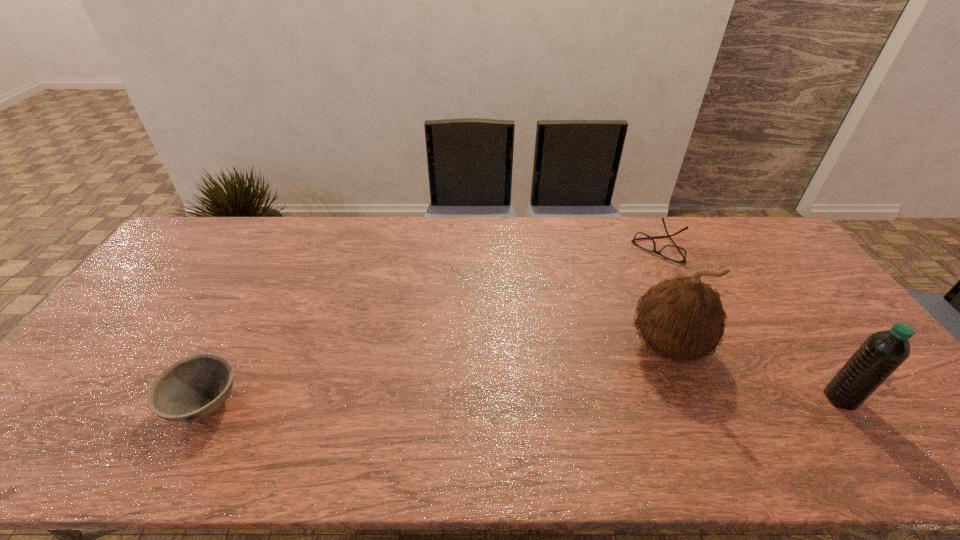
The height and width of the screenshot is (540, 960). I want to click on free spot on the desktop that is between the third tallest object and the water bottle and is positioned on the surface of the coconut, so click(x=578, y=401).

This screenshot has width=960, height=540. Find the location of `vacant space on the desktop that is between the third tallest object and the third shortest object and is positioned on the front-facing side of the shortest object`. vacant space on the desktop that is between the third tallest object and the third shortest object and is positioned on the front-facing side of the shortest object is located at coordinates click(x=533, y=401).